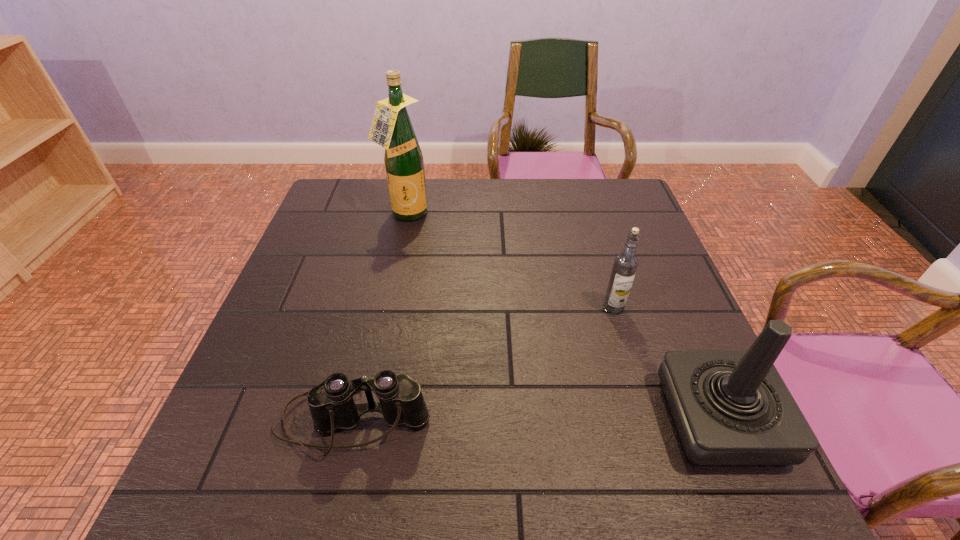
I want to click on unoccupied position between the binoculars and the joystick, so click(x=536, y=421).

Find the location of a particular element. This screenshot has height=540, width=960. vacant space that is in between the liquor and the third object from left to right is located at coordinates (510, 261).

Identify the location of unoccupied area between the rightmost object and the binoculars. This screenshot has height=540, width=960. [536, 421].

Where is `vacant point located between the liquor and the second object from right to left`? The width and height of the screenshot is (960, 540). vacant point located between the liquor and the second object from right to left is located at coordinates (x=510, y=261).

This screenshot has width=960, height=540. What are the coordinates of `vacant point located between the farthest object and the shortest object` in the screenshot? It's located at (379, 318).

At what (x,y) coordinates should I click in order to perform the action: click on vacant area that lies between the third object from left to right and the binoculars. Please return your answer as a coordinate pair (x, y). Looking at the image, I should click on point(483,364).

This screenshot has width=960, height=540. I want to click on free space between the binoculars and the rightmost object, so (536, 421).

Point out which object is positioned as the third nearest to the shortest object. Please provide its 2D coordinates. Your answer should be formatted as a tuple, i.e. [(x, y)], where the tuple contains the x and y coordinates of a point satisfying the conditions above.

[(391, 128)]

At what (x,y) coordinates should I click in order to perform the action: click on object identified as the third closest to the third nearest object. Please return your answer as a coordinate pair (x, y). Looking at the image, I should click on (391, 128).

At what (x,y) coordinates should I click in order to perform the action: click on vacant space that satisfies the following two spatial constraints: 1. on the front side of the liquor; 2. on the front-facing side of the rightmost object. Please return your answer as a coordinate pair (x, y). The image size is (960, 540). Looking at the image, I should click on (362, 420).